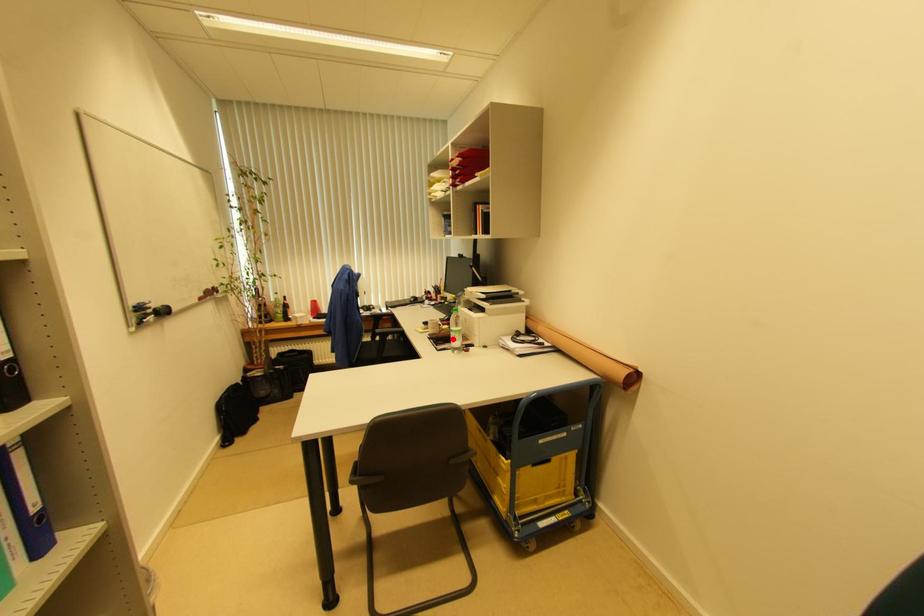
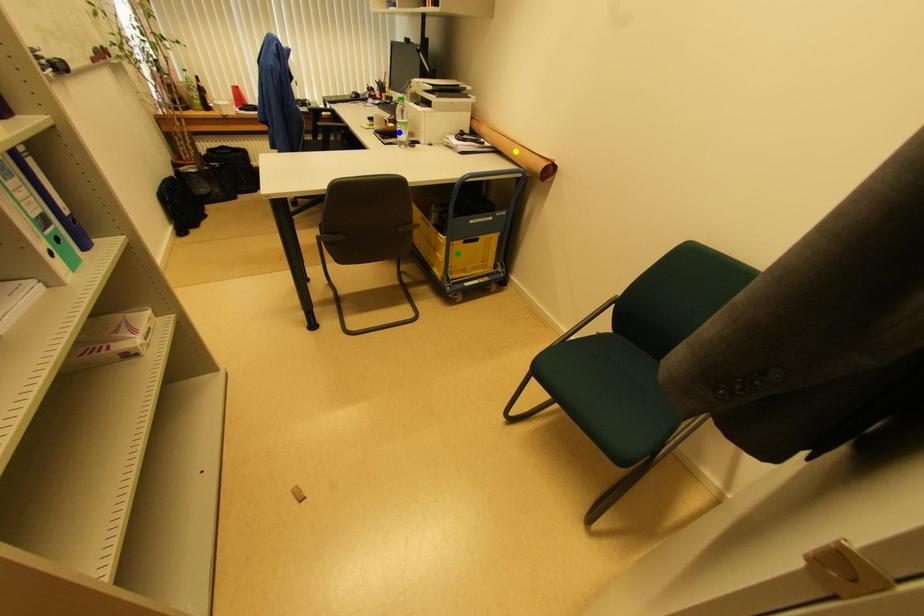
Question: I am providing you with two images of the same scene from different viewpoints. A red point is marked on the first image. You are given multiple points on the second image. In image 2, which mark is for the same physical point as the one in image 1?

Choices:
 (A) yellow point
 (B) blue point
 (C) green point

Answer: (B)